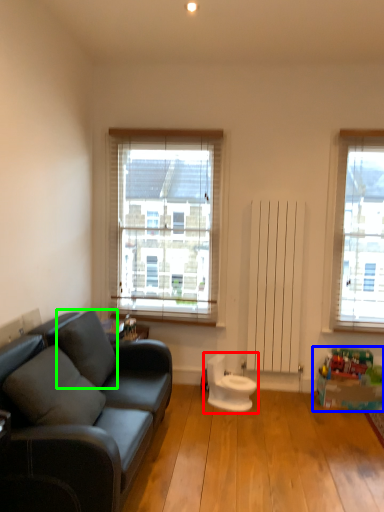
Question: Estimate the real-world distances between objects in this image. Which object is closer to swivel chair (highlighted by a red box), toy (highlighted by a blue box) or pillow (highlighted by a green box)?

Choices:
 (A) toy
 (B) pillow

Answer: (A)